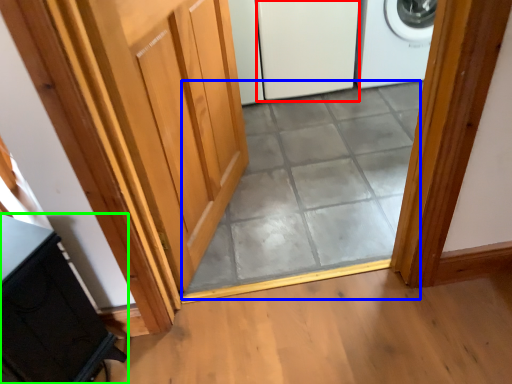
Question: Which object is positioned farthest from screen door (highlighted by a red box)? Select from tile (highlighted by a blue box) and cabinetry (highlighted by a green box).

Choices:
 (A) tile
 (B) cabinetry

Answer: (B)